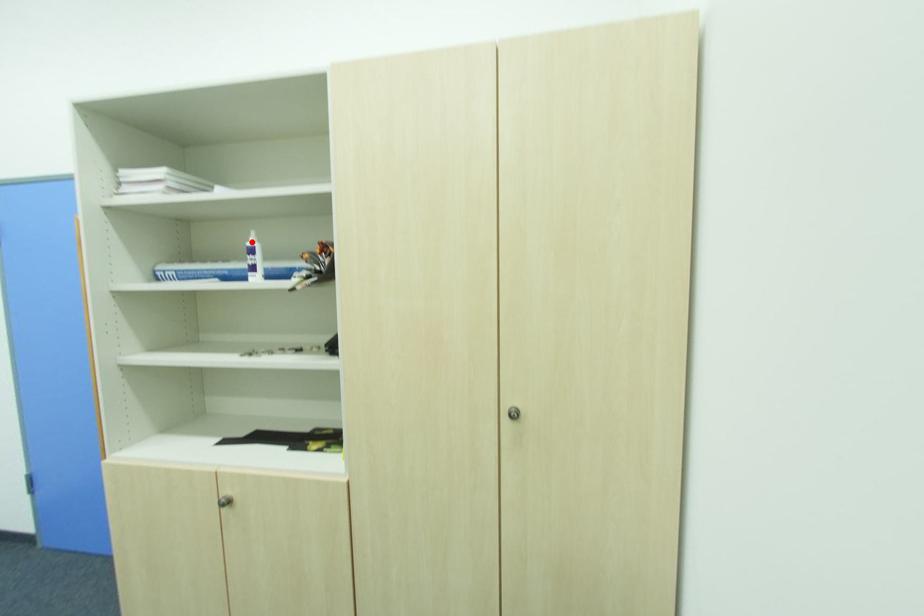
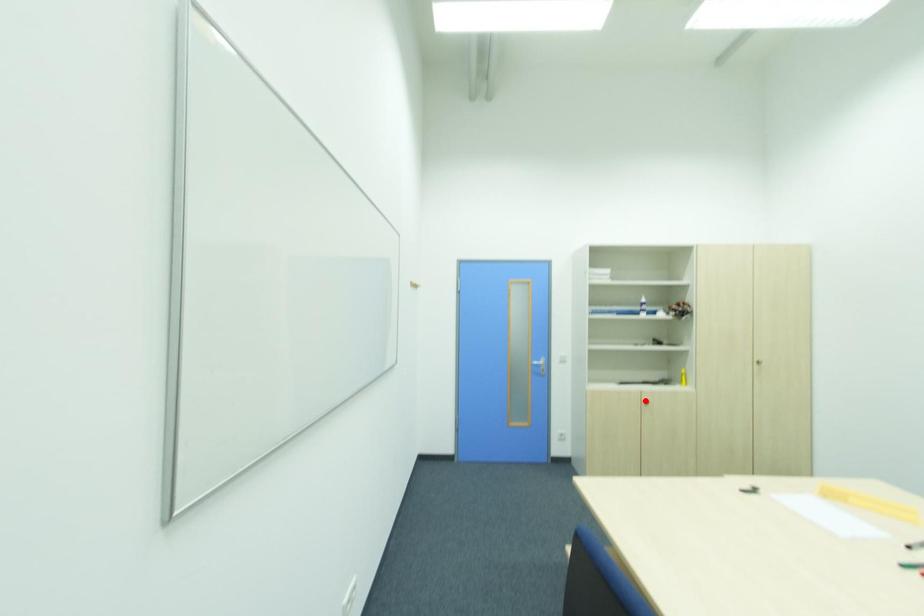
I am providing you with two images of the same scene from different viewpoints. A red point is marked on the first image and another point is marked on the second image. Do the highlighted points in image1 and image2 indicate the same real-world spot?

No